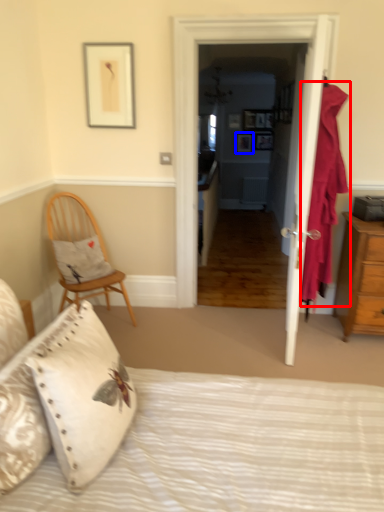
Question: Among these objects, which one is nearest to the camera, curtain (highlighted by a red box) or picture frame (highlighted by a blue box)?

Choices:
 (A) curtain
 (B) picture frame

Answer: (A)